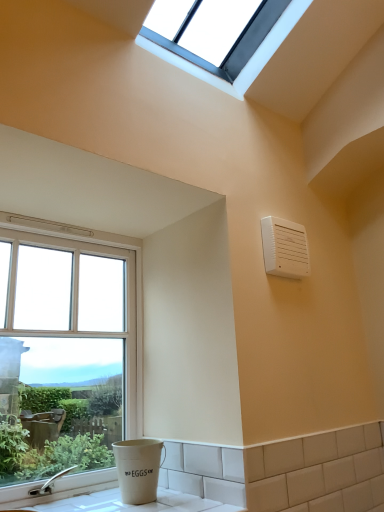
Question: Looking at their shapes, would you say clear glass window at left, marked as the 2th window in a top-to-bottom arrangement, is wider or thinner than white plastic air conditioning unit at upper right?

Choices:
 (A) wide
 (B) thin

Answer: (A)

Question: Is clear glass window at left, placed as the first window when sorted from bottom to top, inside or outside of white plastic air conditioning unit at upper right?

Choices:
 (A) inside
 (B) outside

Answer: (B)

Question: Which object is the closest to the white ceramic counter top at lower left?

Choices:
 (A) clear glass window at left, placed as the 2th window when sorted from right to left
 (B) clear glass window at upper center, the 2th window in the bottom-to-top sequence
 (C) white plastic air conditioning unit at upper right

Answer: (A)

Question: Which of these objects is positioned closest to the clear glass window at left, placed as the first window when sorted from bottom to top?

Choices:
 (A) white ceramic counter top at lower left
 (B) clear glass window at upper center, positioned as the 2th window in left-to-right order
 (C) white plastic air conditioning unit at upper right

Answer: (A)